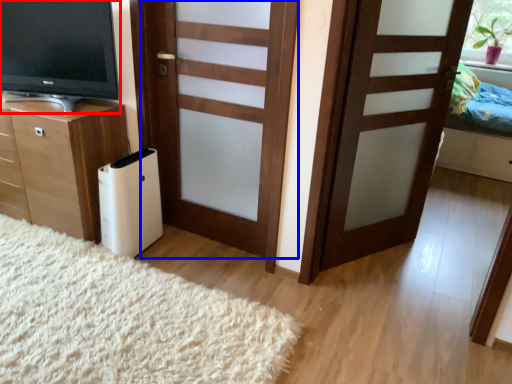
Question: Among these objects, which one is nearest to the camera, television (highlighted by a red box) or door (highlighted by a blue box)?

Choices:
 (A) television
 (B) door

Answer: (B)